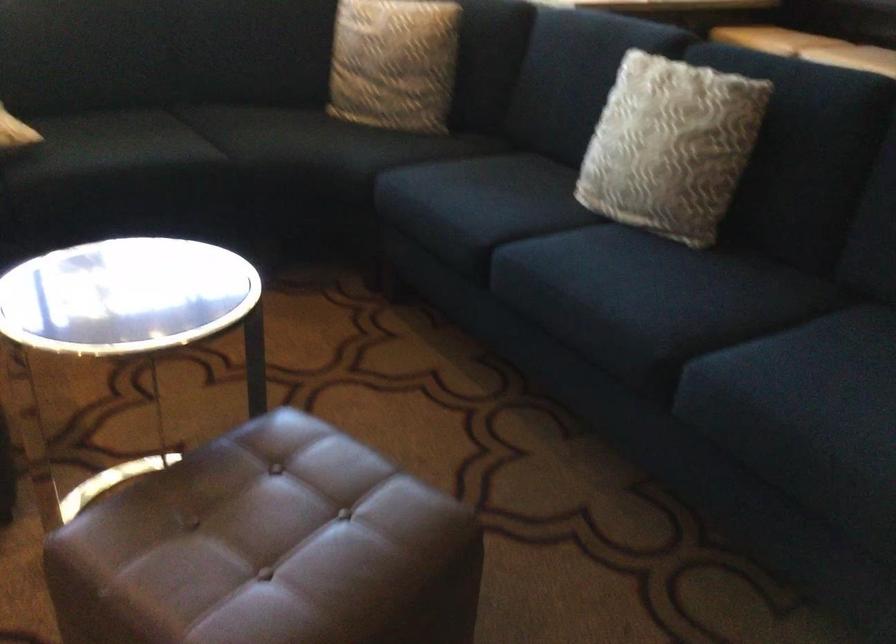
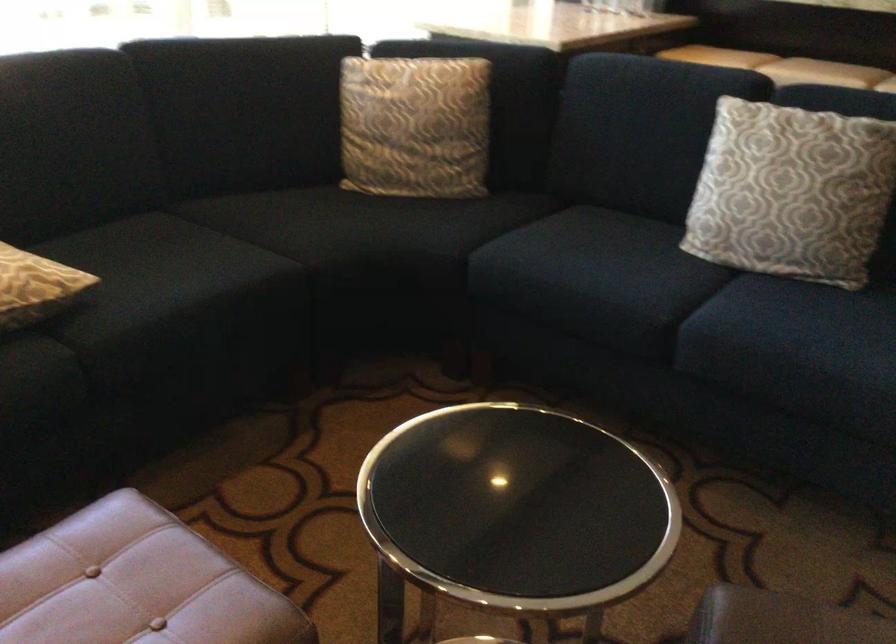
Find the pixel in the second image that matches point 295,136 in the first image.

(348, 227)